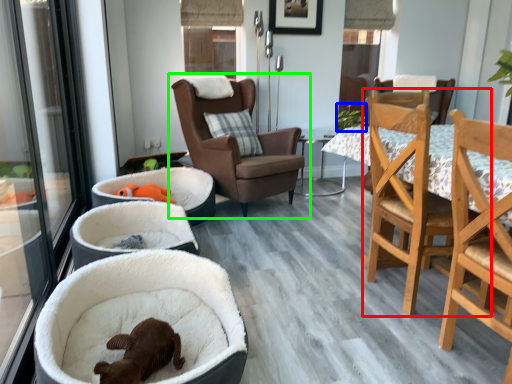
Question: Estimate the real-world distances between objects in this image. Which object is closer to chair (highlighted by a red box), plant (highlighted by a blue box) or chair (highlighted by a green box)?

Choices:
 (A) plant
 (B) chair

Answer: (B)